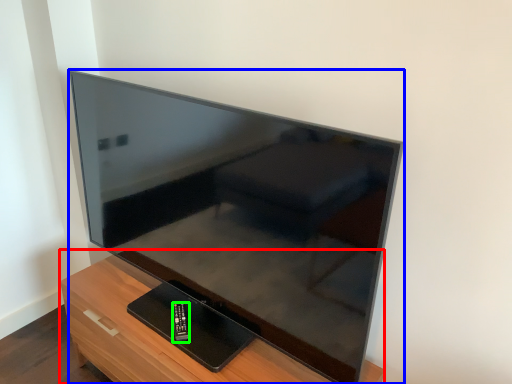
Question: Considering the real-world distances, which object is farthest from furniture (highlighted by a red box)? television (highlighted by a blue box) or control (highlighted by a green box)?

Choices:
 (A) television
 (B) control

Answer: (A)